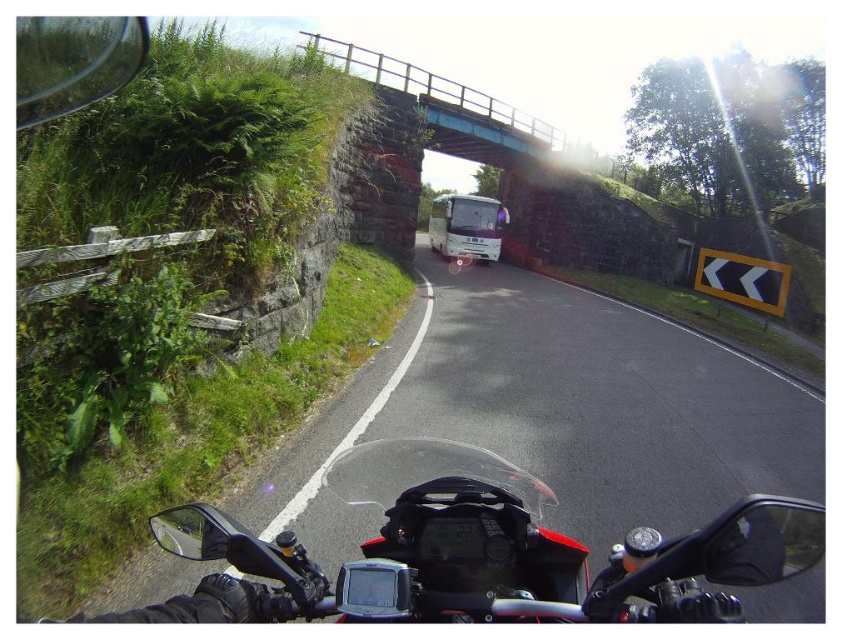
Question: Which of the following is the closest to the observer?

Choices:
 (A) blue painted concrete bridge at upper center
 (B) white glossy bus at center

Answer: (A)

Question: Is blue painted concrete bridge at upper center bigger than white glossy bus at center?

Choices:
 (A) no
 (B) yes

Answer: (B)

Question: Does blue painted concrete bridge at upper center have a smaller size compared to white glossy bus at center?

Choices:
 (A) no
 (B) yes

Answer: (A)

Question: Is blue painted concrete bridge at upper center smaller than white glossy bus at center?

Choices:
 (A) no
 (B) yes

Answer: (A)